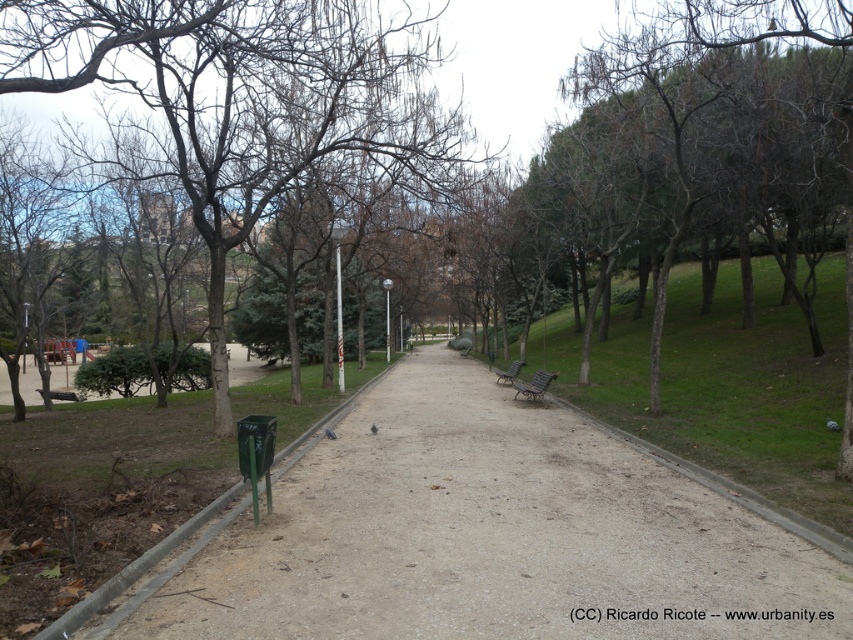
Question: Which object is farther from the camera taking this photo?

Choices:
 (A) brown leafless tree at center
 (B) metallic silver bench at center
 (C) dirt/gravel path at center

Answer: (B)

Question: Considering the relative positions of dirt/gravel path at center and metallic silver bench at center in the image provided, where is dirt/gravel path at center located with respect to metallic silver bench at center?

Choices:
 (A) below
 (B) above

Answer: (A)

Question: Can you confirm if dirt/gravel path at center is positioned below brown leafless tree at center?

Choices:
 (A) yes
 (B) no

Answer: (A)

Question: Can you confirm if dirt/gravel path at center is positioned to the left of metallic silver bench at center?

Choices:
 (A) yes
 (B) no

Answer: (A)

Question: Estimate the real-world distances between objects in this image. Which object is closer to the metallic silver bench at center?

Choices:
 (A) brown leafless tree at center
 (B) dirt/gravel path at center
 (C) green metallic bench at center-right

Answer: (C)

Question: Which object appears farthest from the camera in this image?

Choices:
 (A) dirt/gravel path at center
 (B) green metallic bench at center-right
 (C) brown leafless tree at center

Answer: (B)